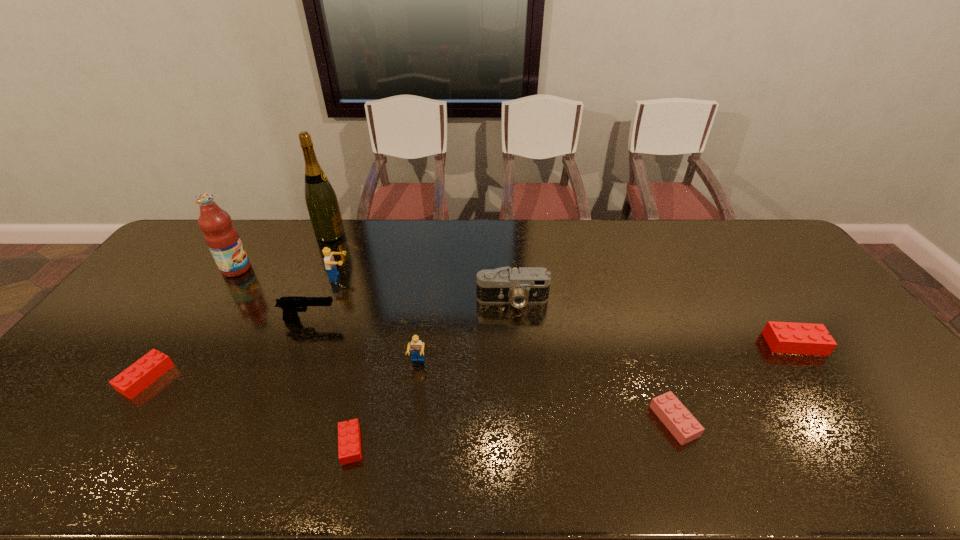
I want to click on object at the right edge, so click(782, 337).

In the image, there is a desktop. At what (x,y) coordinates should I click in order to perform the action: click on vacant space at the far edge. Please return your answer as a coordinate pair (x, y). Looking at the image, I should click on (715, 246).

This screenshot has width=960, height=540. In the image, there is a desktop. Identify the location of vacant space at the near edge. (164, 469).

This screenshot has height=540, width=960. In order to click on vacant space at the far left corner of the desktop in this screenshot , I will do `click(207, 249)`.

Where is `empty space between the nearest red Lego and the fifth Lego from left to right`? Image resolution: width=960 pixels, height=540 pixels. empty space between the nearest red Lego and the fifth Lego from left to right is located at coordinates (513, 433).

The width and height of the screenshot is (960, 540). What are the coordinates of `vacant space that is in between the green wine bottle and the second tallest object` in the screenshot? It's located at (283, 252).

Locate an element on the screen. The image size is (960, 540). vacant area that lies between the seventh nearest object and the second object from right to left is located at coordinates (593, 361).

Locate an element on the screen. This screenshot has width=960, height=540. empty space that is in between the fifth Lego from left to right and the third Lego from right to left is located at coordinates (546, 392).

Where is `free space between the second tallest object and the shortest Lego`? This screenshot has height=540, width=960. free space between the second tallest object and the shortest Lego is located at coordinates (294, 356).

Where is `empty space between the second object from right to left and the green wine bottle`? empty space between the second object from right to left and the green wine bottle is located at coordinates (502, 328).